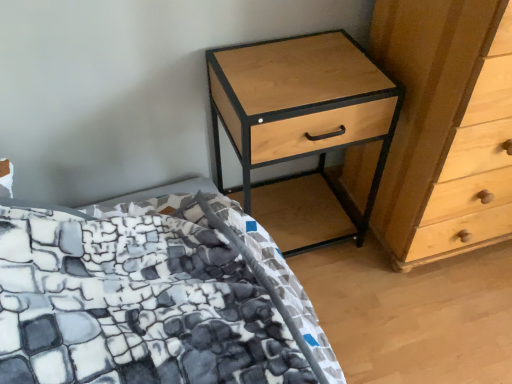
Question: From a real-world perspective, is light wood/texture chest of drawers at right physically located above or below light wood/black metal nightstand at upper right?

Choices:
 (A) below
 (B) above

Answer: (B)

Question: Looking at the image, does light wood/texture chest of drawers at right seem bigger or smaller compared to light wood/black metal nightstand at upper right?

Choices:
 (A) big
 (B) small

Answer: (A)

Question: Based on their relative distances, which object is nearer to the light wood/texture chest of drawers at right?

Choices:
 (A) stone-patterned fabric bed at lower left
 (B) light wood/black metal nightstand at upper right

Answer: (B)

Question: Estimate the real-world distances between objects in this image. Which object is farther from the light wood/black metal nightstand at upper right?

Choices:
 (A) light wood/texture chest of drawers at right
 (B) stone-patterned fabric bed at lower left

Answer: (B)